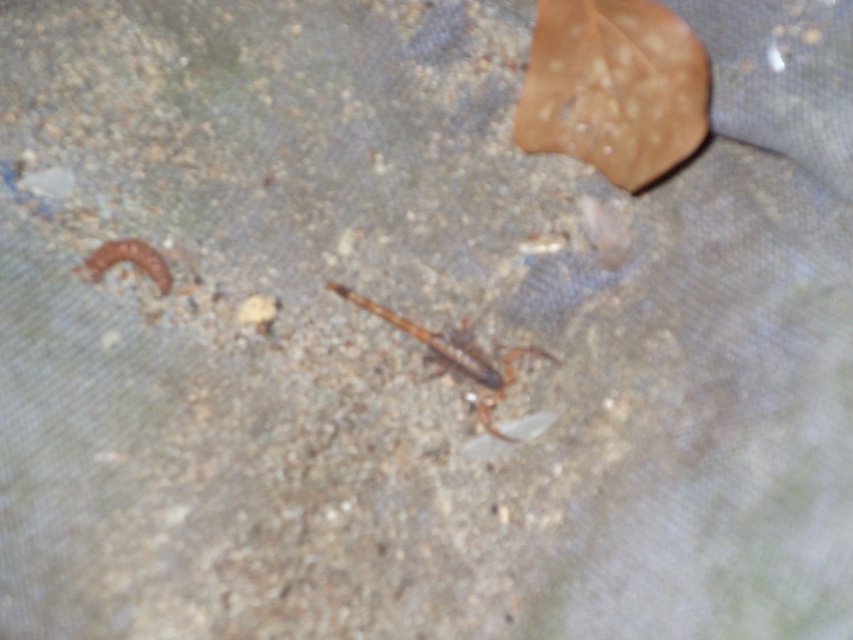
You are standing at the origin point of the image. Where is the brown matte leaf at upper right located in terms of coordinates?

The brown matte leaf at upper right is located at coordinates point (613, 88).

In the scene shown: You are a gardener trying to identify objects in this image. You see the brown matte leaf at upper right and the brown fuzzy worm at left. Which object is wider?

The brown matte leaf at upper right is wider than the brown fuzzy worm at left.

You are a photographer trying to capture a closeup of the brown scaly insect at center and the brown matte leaf at upper right. From your current position, which object is closer to you?

The brown matte leaf at upper right is closer to you because the brown scaly insect at center is behind it.